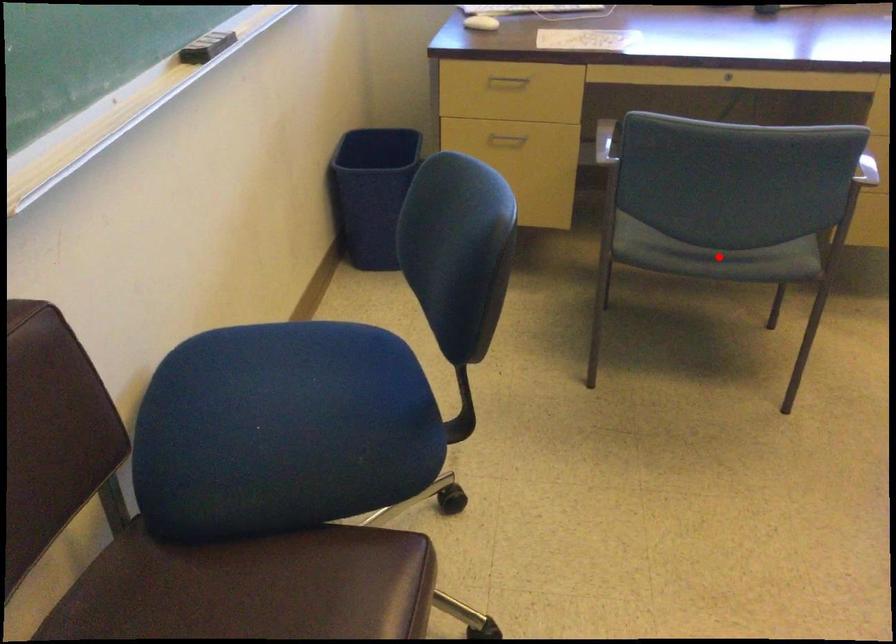
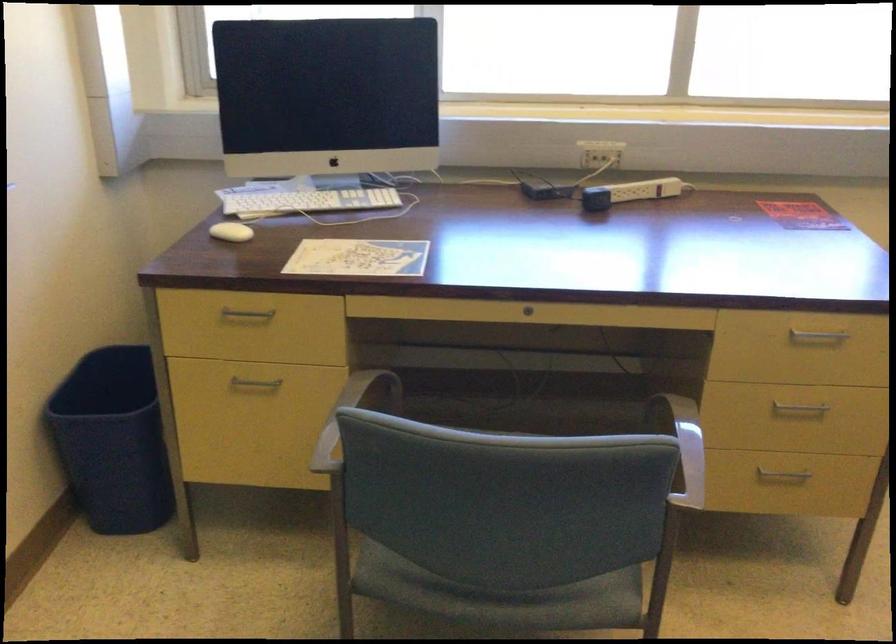
In the second image, find the point that corresponds to the highlighted location in the first image.

(502, 597)